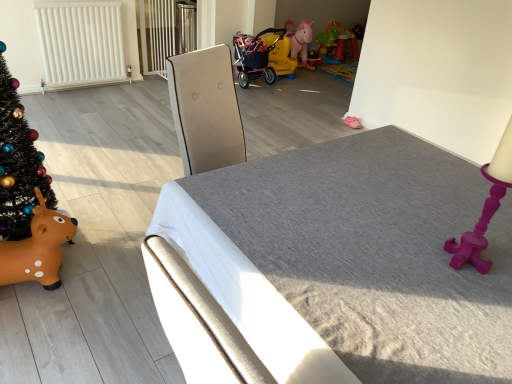
In order to face yellow plastic stroller at center, the third toy when ordered from right to left, should I rotate leftwards or rightwards?

Turn right by 0.285 degrees to look at yellow plastic stroller at center, the third toy when ordered from right to left.

What do you see at coordinates (18, 162) in the screenshot?
I see `black matte christmas tree at left` at bounding box center [18, 162].

What do you see at coordinates (280, 56) in the screenshot? Image resolution: width=512 pixels, height=384 pixels. I see `yellow plastic stroller at center, placed as the 3th toy when sorted from bottom to top` at bounding box center [280, 56].

Where is `yellow plastic stroller at center, the 3th toy viewed from the left`? yellow plastic stroller at center, the 3th toy viewed from the left is located at coordinates (280, 56).

The image size is (512, 384). What are the coordinates of `white matte radiator at upper left` in the screenshot? It's located at (80, 43).

Measure the distance between rubberized plastic playset at upper center, which is the first toy from top to bottom, and camera.

rubberized plastic playset at upper center, which is the first toy from top to bottom, is 5.25 meters from camera.

Where is `rubberized plastic playset at upper center, which is the first toy from top to bottom`? rubberized plastic playset at upper center, which is the first toy from top to bottom is located at coordinates [x=337, y=41].

Find the location of a particular element. yellow plastic stroller at center, acting as the second toy starting from the left is located at coordinates (262, 57).

Considering the sizes of brown rubber reindeer at lower left, which is counted as the 1th toy, starting from the front, and black matte christmas tree at left in the image, is brown rubber reindeer at lower left, which is counted as the 1th toy, starting from the front, wider or thinner than black matte christmas tree at left?

brown rubber reindeer at lower left, which is counted as the 1th toy, starting from the front, is wider than black matte christmas tree at left.

Could you tell me if brown rubber reindeer at lower left, which is counted as the 1th toy, starting from the front, is turned towards black matte christmas tree at left?

No, brown rubber reindeer at lower left, which is counted as the 1th toy, starting from the front, is not turned towards black matte christmas tree at left.

Is rubberized plastic playset at upper center, positioned as the 4th toy in left-to-right order, next to yellow plastic stroller at center, the third toy positioned from the top?

rubberized plastic playset at upper center, positioned as the 4th toy in left-to-right order, and yellow plastic stroller at center, the third toy positioned from the top, are not in contact.

In the scene shown: Could you tell me if rubberized plastic playset at upper center, which is the first toy from top to bottom, is turned towards yellow plastic stroller at center, the third toy when ordered from right to left?

No, rubberized plastic playset at upper center, which is the first toy from top to bottom, is not facing towards yellow plastic stroller at center, the third toy when ordered from right to left.

Do you think rubberized plastic playset at upper center, which is the fourth toy from bottom to top, is within yellow plastic stroller at center, the third toy positioned from the top, or outside of it?

rubberized plastic playset at upper center, which is the fourth toy from bottom to top, is not enclosed by yellow plastic stroller at center, the third toy positioned from the top.

Is yellow plastic stroller at center, the third toy when ordered from right to left, looking in the opposite direction of brown rubber reindeer at lower left, the 1th toy positioned from the left?

yellow plastic stroller at center, the third toy when ordered from right to left, does not have its back to brown rubber reindeer at lower left, the 1th toy positioned from the left.

Based on the photo, considering the positions of objects yellow plastic stroller at center, which ranks as the 2th toy in front-to-back order, and brown rubber reindeer at lower left, which is counted as the fourth toy, starting from the right, in the image provided, who is behind, yellow plastic stroller at center, which ranks as the 2th toy in front-to-back order, or brown rubber reindeer at lower left, which is counted as the fourth toy, starting from the right,?

yellow plastic stroller at center, which ranks as the 2th toy in front-to-back order, is further away from the camera.

Which object is wider, yellow plastic stroller at center, marked as the second toy in a bottom-to-top arrangement, or brown rubber reindeer at lower left, the fourth toy in the back-to-front sequence?

Wider between the two is yellow plastic stroller at center, marked as the second toy in a bottom-to-top arrangement.

Is white matte radiator at upper left placed right next to rubberized plastic playset at upper center, which is counted as the 4th toy, starting from the front?

No, white matte radiator at upper left is not with rubberized plastic playset at upper center, which is counted as the 4th toy, starting from the front.

From a real-world perspective, between white matte radiator at upper left and rubberized plastic playset at upper center, the first toy from the right, who is vertically lower?

In real-world perspective, rubberized plastic playset at upper center, the first toy from the right, is lower.

How different are the orientations of white matte radiator at upper left and rubberized plastic playset at upper center, positioned as the 4th toy in left-to-right order, in degrees?

There is a 1.69-degree angle between the facing directions of white matte radiator at upper left and rubberized plastic playset at upper center, positioned as the 4th toy in left-to-right order.

Considering the relative positions of white matte radiator at upper left and rubberized plastic playset at upper center, positioned as the 4th toy in left-to-right order, in the image provided, is white matte radiator at upper left behind rubberized plastic playset at upper center, positioned as the 4th toy in left-to-right order,?

That is False.

Considering the sizes of rubberized plastic playset at upper center, positioned as the 4th toy in left-to-right order, and white matte radiator at upper left in the image, is rubberized plastic playset at upper center, positioned as the 4th toy in left-to-right order, taller or shorter than white matte radiator at upper left?

Clearly, rubberized plastic playset at upper center, positioned as the 4th toy in left-to-right order, is shorter compared to white matte radiator at upper left.

Is rubberized plastic playset at upper center, which is counted as the first toy, starting from the back, next to white matte radiator at upper left and touching it?

No, rubberized plastic playset at upper center, which is counted as the first toy, starting from the back, is not next to white matte radiator at upper left.

Does rubberized plastic playset at upper center, which is the fourth toy from bottom to top, have a larger size compared to white matte radiator at upper left?

Indeed, rubberized plastic playset at upper center, which is the fourth toy from bottom to top, has a larger size compared to white matte radiator at upper left.

Who is shorter, textured gray mattress at center or brown rubber reindeer at lower left, the 1th toy positioned from the left?

brown rubber reindeer at lower left, the 1th toy positioned from the left, is shorter.

Is brown rubber reindeer at lower left, the 1th toy positioned from the left, surrounded by textured gray mattress at center?

Definitely not — brown rubber reindeer at lower left, the 1th toy positioned from the left, is not inside textured gray mattress at center.

Which is more to the right, textured gray mattress at center or brown rubber reindeer at lower left, the fourth toy from the top?

From the viewer's perspective, textured gray mattress at center appears more on the right side.

Does textured gray mattress at center have a larger size compared to brown rubber reindeer at lower left, which is counted as the 1th toy, starting from the front?

Yes.

Which is more to the left, brown rubber reindeer at lower left, the 1th toy positioned from the left, or rubberized plastic playset at upper center, which is the fourth toy from bottom to top?

brown rubber reindeer at lower left, the 1th toy positioned from the left, is more to the left.

Which object is further away from the camera, brown rubber reindeer at lower left, placed as the 1th toy when sorted from bottom to top, or rubberized plastic playset at upper center, positioned as the 4th toy in left-to-right order?

rubberized plastic playset at upper center, positioned as the 4th toy in left-to-right order, is further from the camera.

Between point (44, 220) and point (339, 58), which one is positioned in front?

The point (44, 220) is closer.

Would you say brown rubber reindeer at lower left, the fourth toy in the back-to-front sequence, is inside or outside rubberized plastic playset at upper center, which is counted as the first toy, starting from the back?

brown rubber reindeer at lower left, the fourth toy in the back-to-front sequence, exists outside the volume of rubberized plastic playset at upper center, which is counted as the first toy, starting from the back.

Where is `christmas tree on the left of brown rubber reindeer at lower left, which is counted as the fourth toy, starting from the right`? christmas tree on the left of brown rubber reindeer at lower left, which is counted as the fourth toy, starting from the right is located at coordinates (18, 162).

Find the location of a particular element. Image resolution: width=512 pixels, height=384 pixels. toy that is the 2nd object located below the rubberized plastic playset at upper center, which is the fourth toy from bottom to top (from the image's perspective) is located at coordinates (262, 57).

When comparing their distances from rubberized plastic playset at upper center, which is the fourth toy from bottom to top, does brown rubber reindeer at lower left, the fourth toy in the back-to-front sequence, or black matte christmas tree at left seem further?

brown rubber reindeer at lower left, the fourth toy in the back-to-front sequence, lies further to rubberized plastic playset at upper center, which is the fourth toy from bottom to top, than the other object.

When comparing their distances from rubberized plastic playset at upper center, which is the fourth toy from bottom to top, does yellow plastic stroller at center, placed as the 3th toy when sorted from bottom to top, or white matte radiator at upper left seem closer?

yellow plastic stroller at center, placed as the 3th toy when sorted from bottom to top, lies closer to rubberized plastic playset at upper center, which is the fourth toy from bottom to top, than the other object.

Estimate the real-world distances between objects in this image. Which object is further from white matte radiator at upper left, textured gray mattress at center or brown rubber reindeer at lower left, placed as the 1th toy when sorted from bottom to top?

textured gray mattress at center.

From the image, which object appears to be farther from textured gray mattress at center, rubberized plastic playset at upper center, which is counted as the 4th toy, starting from the front, or black matte christmas tree at left?

Based on the image, rubberized plastic playset at upper center, which is counted as the 4th toy, starting from the front, appears to be further to textured gray mattress at center.

Which object lies further to the anchor point brown rubber reindeer at lower left, the fourth toy from the top, yellow plastic stroller at center, placed as the 3th toy when sorted from bottom to top, or textured gray mattress at center?

Based on the image, yellow plastic stroller at center, placed as the 3th toy when sorted from bottom to top, appears to be further to brown rubber reindeer at lower left, the fourth toy from the top.

Considering their positions, is brown rubber reindeer at lower left, the 1th toy positioned from the left, positioned further to rubberized plastic playset at upper center, positioned as the 4th toy in left-to-right order, than yellow plastic stroller at center, the 2th toy from the top?

brown rubber reindeer at lower left, the 1th toy positioned from the left, is further to rubberized plastic playset at upper center, positioned as the 4th toy in left-to-right order.

In the scene shown: Considering their positions, is white matte radiator at upper left positioned further to brown rubber reindeer at lower left, placed as the 1th toy when sorted from bottom to top, than textured gray mattress at center?

white matte radiator at upper left is positioned further to the anchor brown rubber reindeer at lower left, placed as the 1th toy when sorted from bottom to top.

From the image, which object appears to be farther from rubberized plastic playset at upper center, the first toy from the right, brown rubber reindeer at lower left, the 1th toy positioned from the left, or textured gray mattress at center?

The object further to rubberized plastic playset at upper center, the first toy from the right, is brown rubber reindeer at lower left, the 1th toy positioned from the left.

Where is `radiator positioned between black matte christmas tree at left and yellow plastic stroller at center, the 3th toy from the back, from near to far`? The width and height of the screenshot is (512, 384). radiator positioned between black matte christmas tree at left and yellow plastic stroller at center, the 3th toy from the back, from near to far is located at coordinates (80, 43).

Where is `christmas tree between textured gray mattress at center and rubberized plastic playset at upper center, which is counted as the first toy, starting from the back, from front to back`? Image resolution: width=512 pixels, height=384 pixels. christmas tree between textured gray mattress at center and rubberized plastic playset at upper center, which is counted as the first toy, starting from the back, from front to back is located at coordinates (18, 162).

The height and width of the screenshot is (384, 512). In order to click on radiator between textured gray mattress at center and yellow plastic stroller at center, the 2th toy from the top, from front to back in this screenshot , I will do `click(80, 43)`.

Where is `radiator between black matte christmas tree at left and rubberized plastic playset at upper center, which is the first toy from top to bottom, in the front-back direction`? The image size is (512, 384). radiator between black matte christmas tree at left and rubberized plastic playset at upper center, which is the first toy from top to bottom, in the front-back direction is located at coordinates (80, 43).